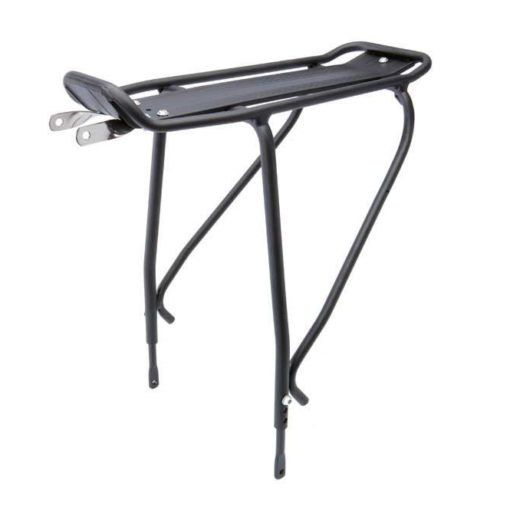
Locate an element on the screen. The width and height of the screenshot is (510, 510). sides of the seat is located at coordinates (287, 106), (242, 72).